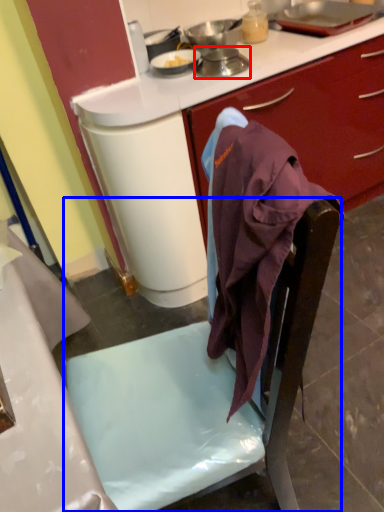
Question: Which of the following is the closest to the observer, kitchen appliance (highlighted by a red box) or chair (highlighted by a blue box)?

Choices:
 (A) kitchen appliance
 (B) chair

Answer: (B)